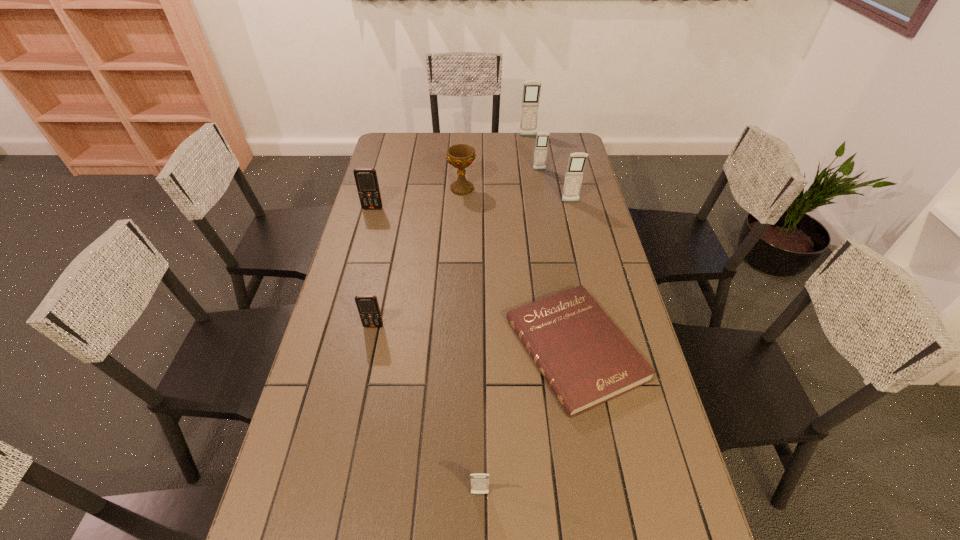
At what (x,y) coordinates should I click in order to perform the action: click on gray cellular telephone that can be found as the third closest to the rightmost gray cellular telephone. Please return your answer as a coordinate pair (x, y). The width and height of the screenshot is (960, 540). Looking at the image, I should click on (479, 482).

Locate which gray cellular telephone ranks third in proximity to the hardback book. Please provide its 2D coordinates. Your answer should be formatted as a tuple, i.e. [(x, y)], where the tuple contains the x and y coordinates of a point satisfying the conditions above.

[(542, 139)]

The height and width of the screenshot is (540, 960). I want to click on free space that satisfies the following two spatial constraints: 1. on the screen of the smaller orange cellular telephone; 2. on the right side of the shortest object, so click(x=369, y=349).

The width and height of the screenshot is (960, 540). Find the location of `free space in the image that satisfies the following two spatial constraints: 1. on the front-facing side of the shortest object; 2. on the left side of the second farthest cellular telephone`. free space in the image that satisfies the following two spatial constraints: 1. on the front-facing side of the shortest object; 2. on the left side of the second farthest cellular telephone is located at coordinates (569, 349).